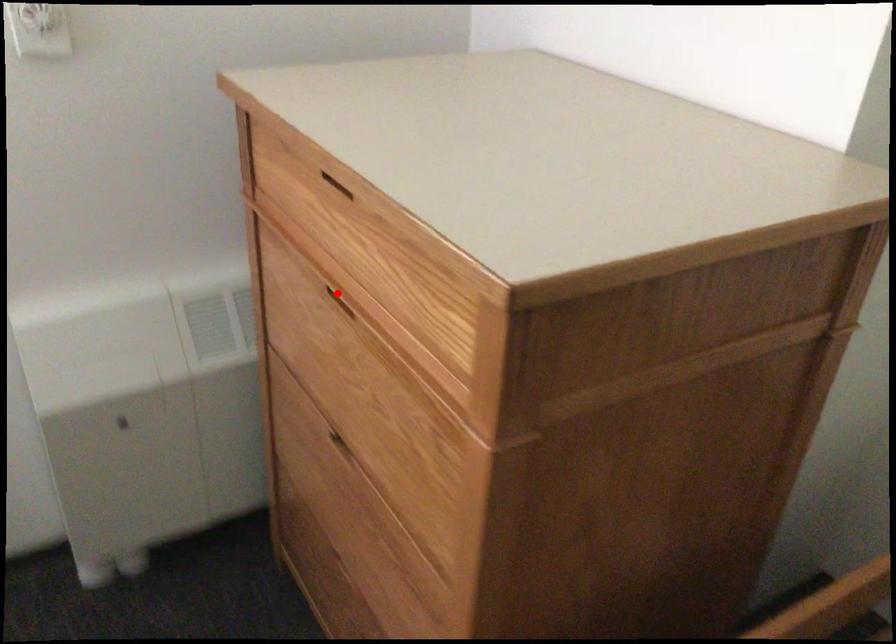
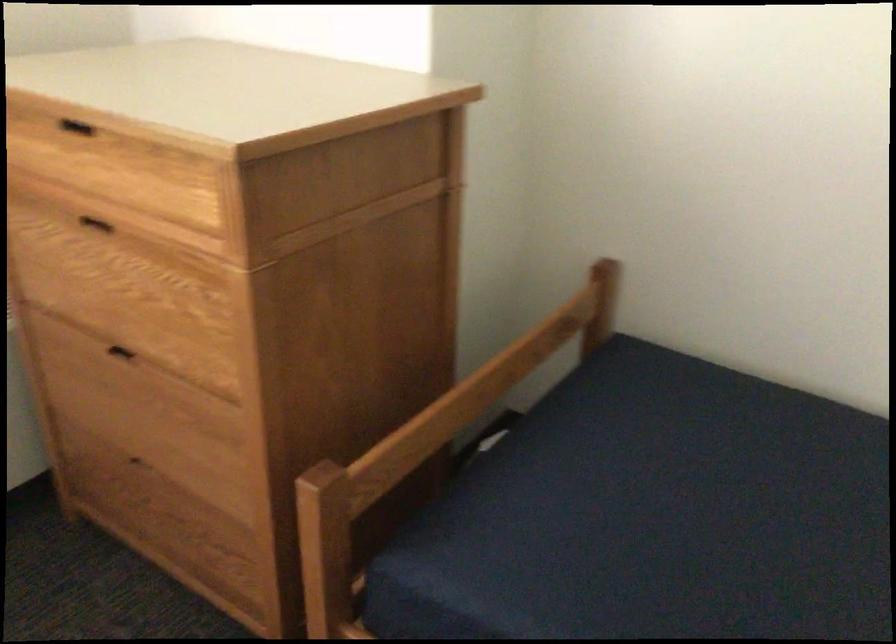
Question: I am providing you with two images of the same scene from different viewpoints. A red point is shown in image1. For the corresponding object point in image2, is it positioned nearer or farther from the camera?

Choices:
 (A) Nearer
 (B) Farther

Answer: (B)